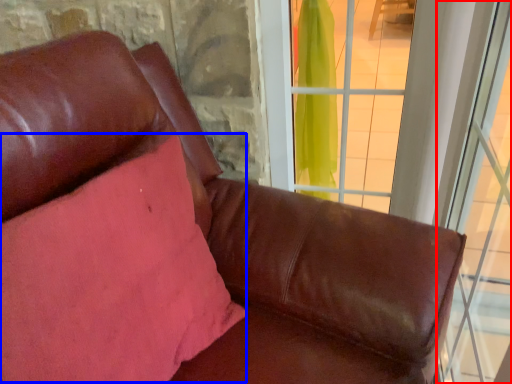
Question: Which of the following is the closest to the observer, window (highlighted by a red box) or pillow (highlighted by a blue box)?

Choices:
 (A) window
 (B) pillow

Answer: (A)